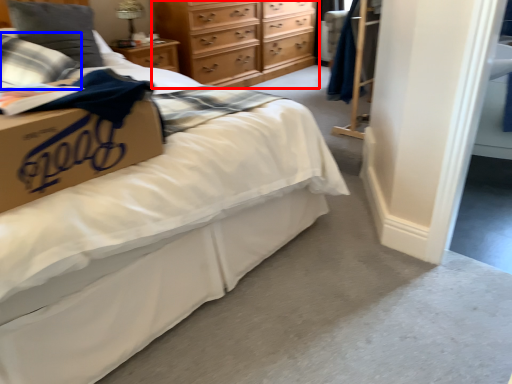
Question: Among these objects, which one is farthest to the camera, chest of drawers (highlighted by a red box) or pillow (highlighted by a blue box)?

Choices:
 (A) chest of drawers
 (B) pillow

Answer: (A)